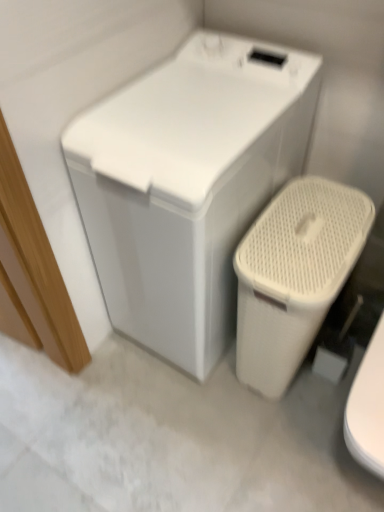
Locate an element on the screen. This screenshot has width=384, height=512. free location in front of beige textured plastic toilet at lower right is located at coordinates (272, 438).